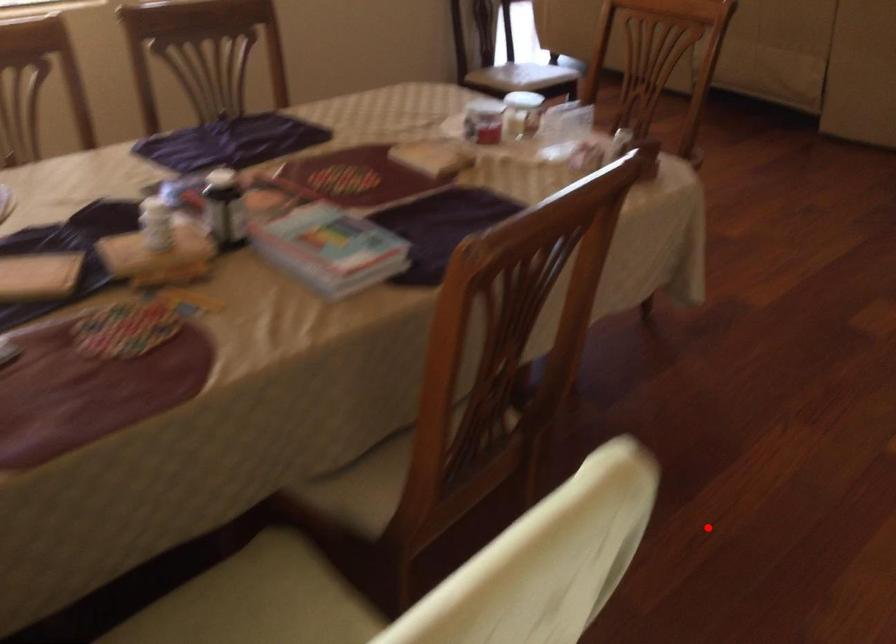
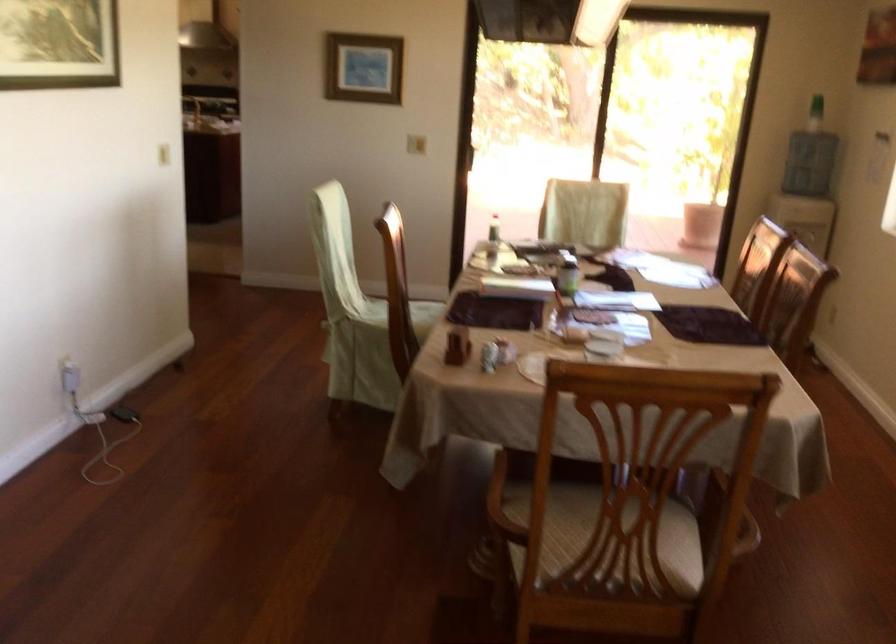
The point at the highlighted location is marked in the first image. Where is the corresponding point in the second image?

(316, 540)